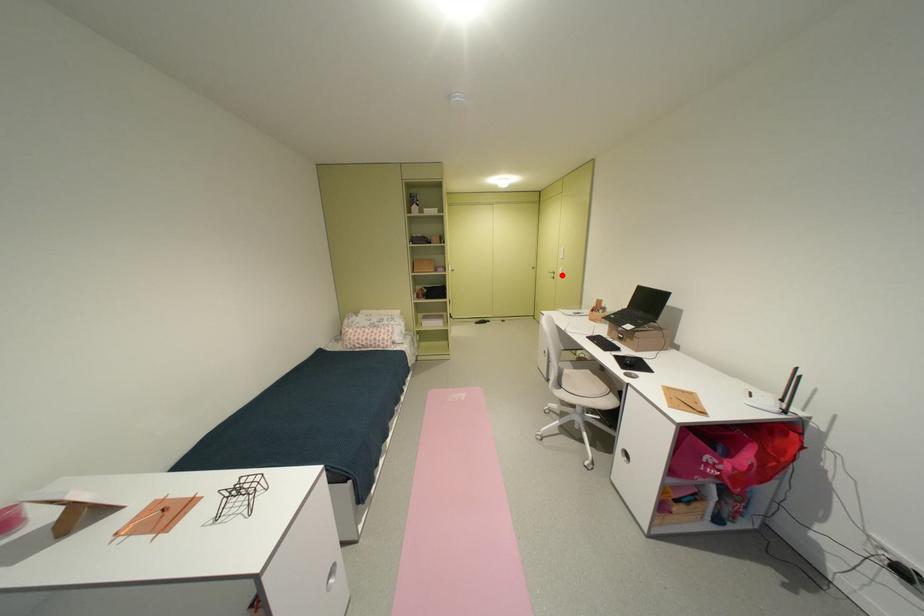
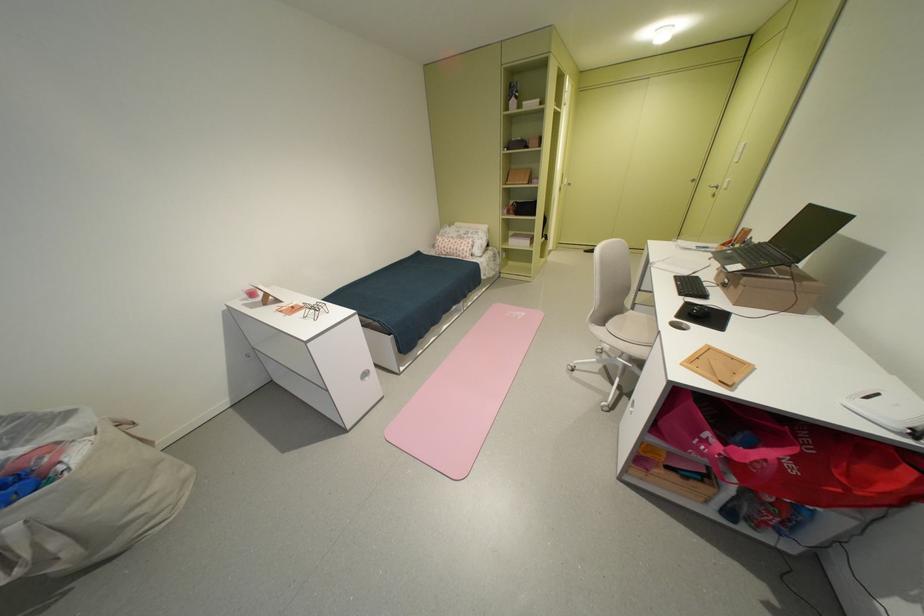
In the second image, find the point that corresponds to the highlighted location in the first image.

(724, 190)